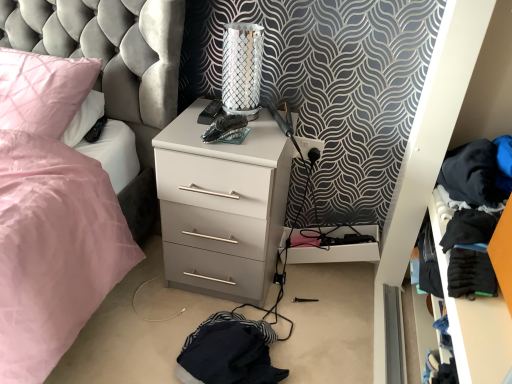
I want to click on free space in front of white matte chest of drawers at center, so click(180, 339).